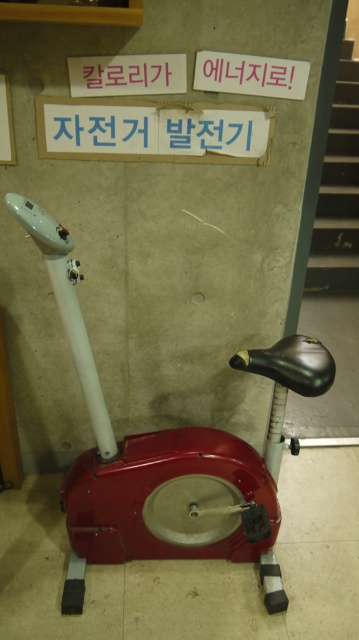
Question: Which of the following is the farthest from the observer?

Choices:
 (A) matte pink sign at upper center
 (B) blue paper sign at center
 (C) smooth concrete stairs at right

Answer: (C)

Question: Does blue paper sign at center appear over smooth concrete stairs at right?

Choices:
 (A) no
 (B) yes

Answer: (A)

Question: Does matte pink sign at upper center have a larger size compared to red plastic sign at upper center?

Choices:
 (A) no
 (B) yes

Answer: (B)

Question: Does matte pink sign at upper center appear over white paper at upper center?

Choices:
 (A) no
 (B) yes

Answer: (A)

Question: Which point is farther from the camera taking this photo?

Choices:
 (A) (342, 44)
 (B) (169, 554)

Answer: (A)

Question: Among these points, which one is nearest to the camera?

Choices:
 (A) (104, 65)
 (B) (260, 356)
 (C) (253, 88)
 (D) (356, 93)

Answer: (A)